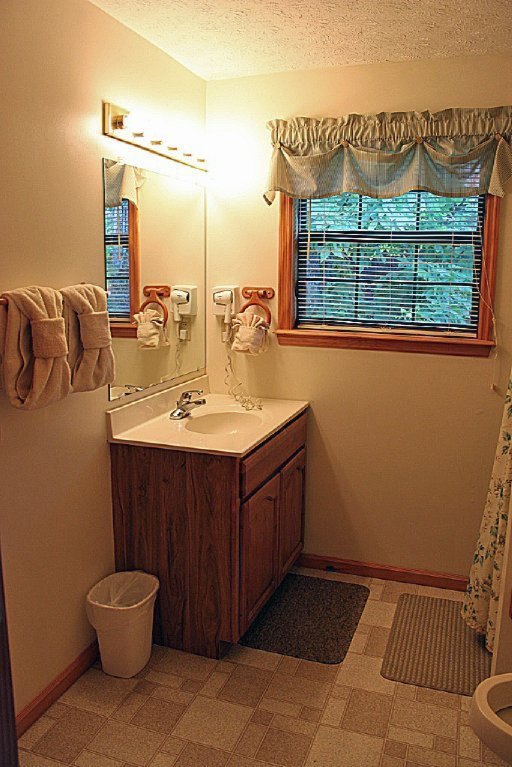
Find the location of a particular element. This screenshot has width=512, height=767. carpet is located at coordinates (315, 621).